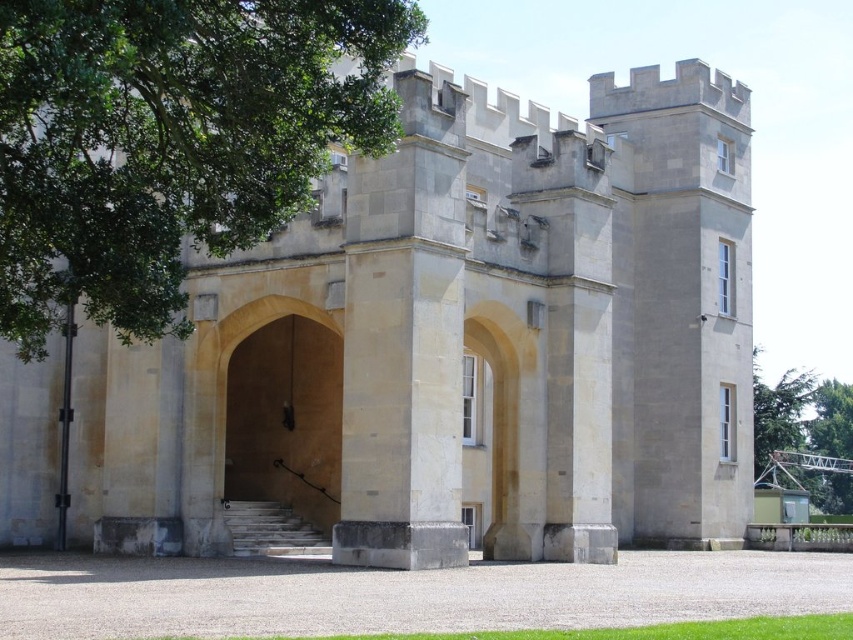
Who is taller, beige stone archway at center or green leafy tree at right?

green leafy tree at right

From the picture: Is beige stone archway at center shorter than green leafy tree at right?

Yes.

Is point (286, 396) behind point (813, 396)?

No, (286, 396) is closer to viewer.

I want to click on beige stone archway at center, so click(x=285, y=419).

Does beige stone gate at center have a greater height compared to green leafy tree at right?

Correct, beige stone gate at center is much taller as green leafy tree at right.

Between point (444, 484) and point (827, 419), which one is positioned in front?

Point (444, 484) is more forward.

Measure the distance between point (22, 406) and camera.

Point (22, 406) is 58.48 meters away from camera.

In order to click on beige stone gate at center in this screenshot , I will do `click(460, 342)`.

Who is lower down, beige stone archway at center or green leafy tree at upper right?

green leafy tree at upper right is below.

Does point (329, 388) come farther from viewer compared to point (792, 420)?

No, it is not.

Locate an element on the screen. This screenshot has width=853, height=640. beige stone archway at center is located at coordinates (285, 419).